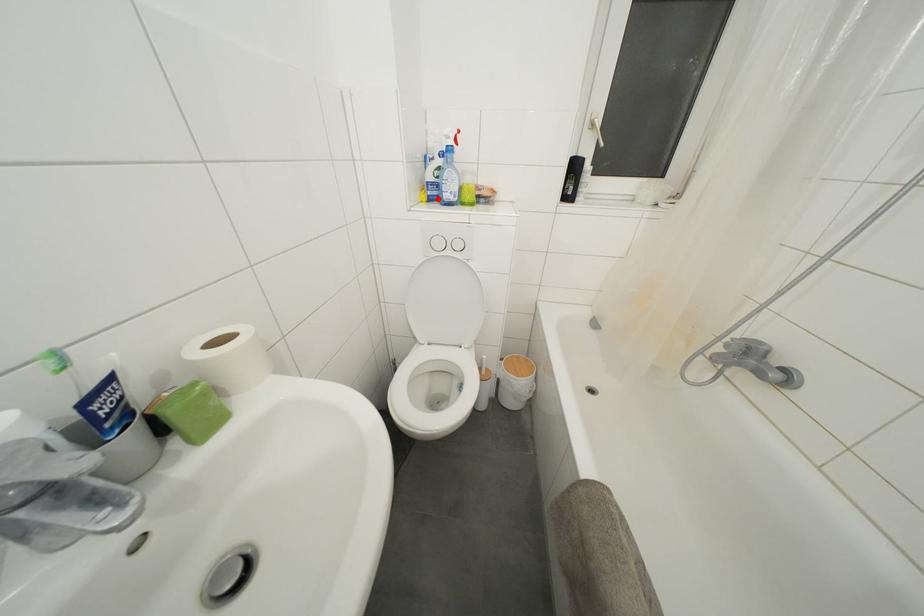
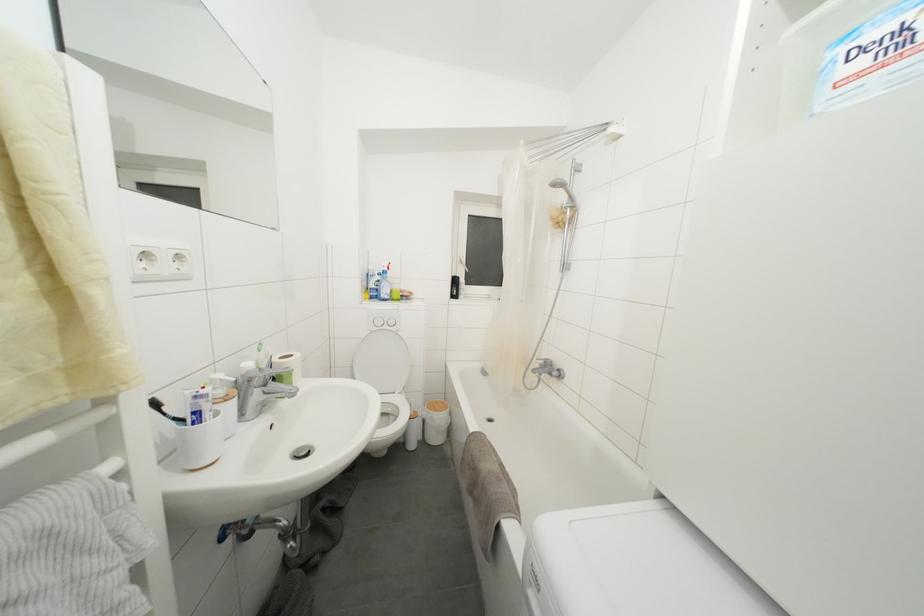
Locate, in the second image, the point that corresponds to the highlighted location in the first image.

(379, 300)